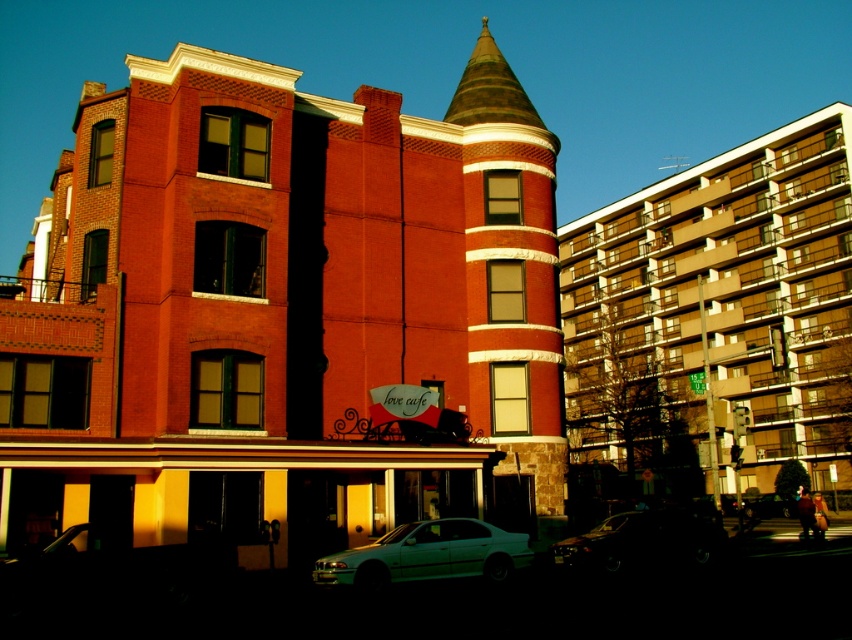
Question: Can you confirm if white glossy sedan at lower center is positioned to the right of metallic silver sedan at center?

Choices:
 (A) yes
 (B) no

Answer: (B)

Question: Is white glossy sedan at lower center bigger than shiny black sedan at lower center?

Choices:
 (A) no
 (B) yes

Answer: (A)

Question: Which of the following is the closest to the observer?

Choices:
 (A) white glossy sedan at lower center
 (B) metallic silver sedan at center

Answer: (A)

Question: Among these objects, which one is nearest to the camera?

Choices:
 (A) white glossy sedan at lower center
 (B) metallic silver sedan at center
 (C) shiny black sedan at lower center

Answer: (A)

Question: Estimate the real-world distances between objects in this image. Which object is closer to the white glossy sedan at lower center?

Choices:
 (A) metallic silver sedan at center
 (B) shiny black sedan at lower center

Answer: (B)

Question: Can you confirm if shiny black sedan at lower center is positioned below metallic silver sedan at center?

Choices:
 (A) yes
 (B) no

Answer: (B)